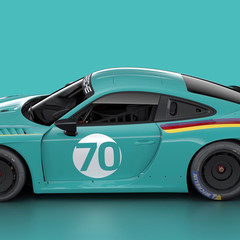
Find the location of a particular element. hood is located at coordinates (11, 104).